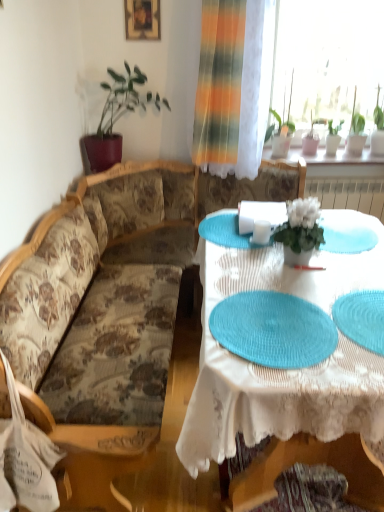
Locate an element on the screen. The width and height of the screenshot is (384, 512). vacant space to the right of white matte flower pot at center, positioned as the 5th houseplant in back-to-front order is located at coordinates (347, 257).